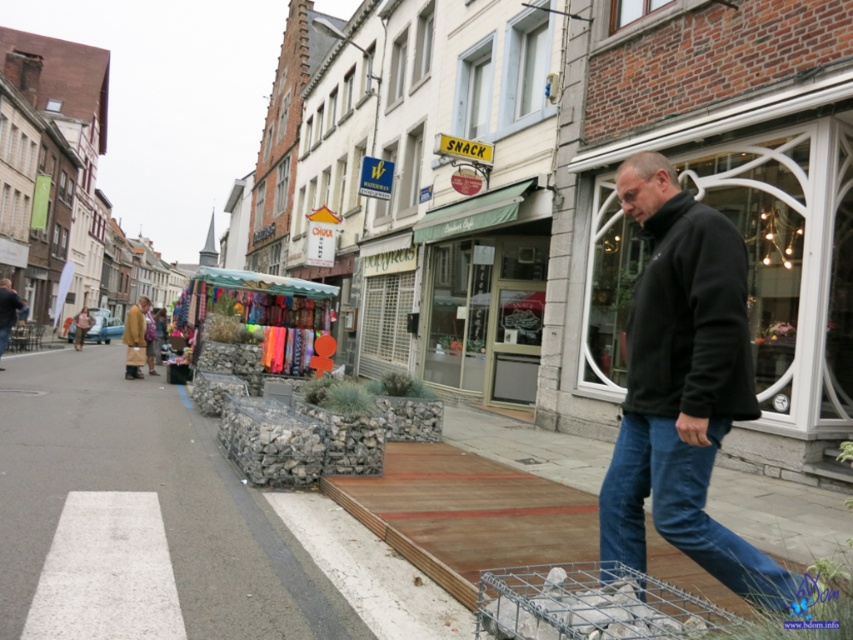
You are a tourist standing on the sidewalk and want to take a photo of the green awning at center while also including the black fleece jacket at center in the frame. Can you position yourself so that both are visible in the same photo without moving either object?

The black fleece jacket at center is to the right of the green awning at center, so you can position yourself to the left of both objects to capture both in the same frame.

You are a delivery person carrying a box that is 1.5 meters wide. You need to navigate through the street scene shown in the image. Can you pass through the area between the gray concrete pavement at lower left and the blue denim jeans at lower right without tilting the box?

The gray concrete pavement at lower left is wider than the blue denim jeans at lower right. Since the box is 1.5 meters wide, you need to check the minimum width between them. However, the description only states the pavement is wider, but not the exact dimensions. Without knowing the exact width of the narrowest point, it is uncertain if the box can pass safely. Proceed with caution and measure the space first.

You are a delivery person carrying a box and need to step from the gray concrete pavement at lower left to the blue denim jeans at lower right. Considering their heights, will you need to step up or down?

The gray concrete pavement at lower left has a lesser height compared to the blue denim jeans at lower right, so you will need to step up to move from the gray concrete pavement at lower left to the blue denim jeans at lower right.